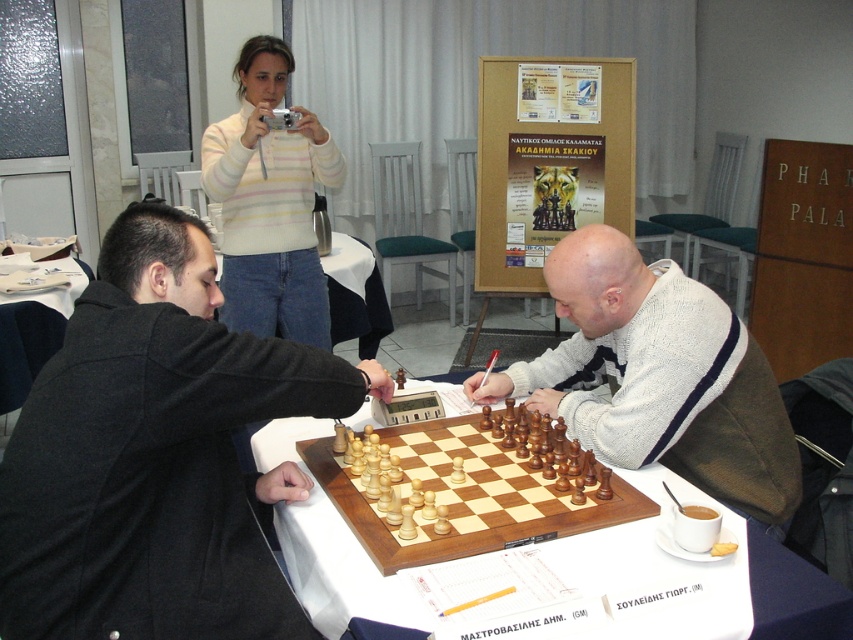
Consider the image. Is dark gray wool coat at center above wooden chess set at center?

Actually, dark gray wool coat at center is below wooden chess set at center.

Between point (198, 300) and point (585, 429), which one is positioned behind?

Point (585, 429)

Find the location of a particular element. This screenshot has width=853, height=640. dark gray wool coat at center is located at coordinates (155, 454).

Can you confirm if wooden chess set at center is positioned below light brown wooden chessboard at center?

No.

This screenshot has height=640, width=853. What do you see at coordinates (659, 378) in the screenshot?
I see `wooden chess set at center` at bounding box center [659, 378].

Where is `wooden chess set at center`? wooden chess set at center is located at coordinates tap(659, 378).

Is wooden chess set at center below wooden chessboard at center?

Actually, wooden chess set at center is above wooden chessboard at center.

In order to click on wooden chess set at center in this screenshot , I will do `click(659, 378)`.

You are a GUI agent. You are given a task and a screenshot of the screen. Output one action in this format:
    pyautogui.click(x=<x>, y=<y>)
    Task: Click on the wooden chess set at center
    The height and width of the screenshot is (640, 853).
    Given the screenshot: What is the action you would take?
    pyautogui.click(x=659, y=378)